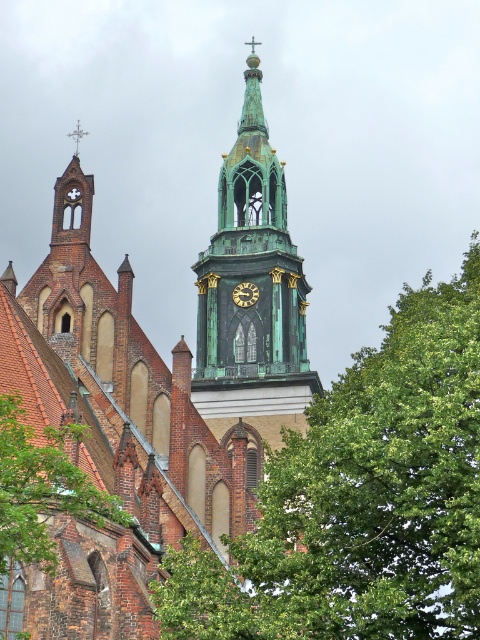
Question: Does green leafy tree at center appear on the right side of green leafy tree at lower left?

Choices:
 (A) yes
 (B) no

Answer: (A)

Question: Which point is closer to the camera?

Choices:
 (A) (54, 545)
 (B) (471, 436)

Answer: (B)

Question: Among these points, which one is farthest from the camera?

Choices:
 (A) click(236, 470)
 (B) click(405, 401)
 (C) click(110, 509)

Answer: (A)

Question: Which point is farther to the camera?

Choices:
 (A) green copper steeple at upper center
 (B) dark brown wooden clock at center
 (C) green leafy tree at lower left
 (D) green leafy tree at center

Answer: (B)

Question: Is green leafy tree at center positioned at the back of green leafy tree at lower left?

Choices:
 (A) no
 (B) yes

Answer: (B)

Question: In this image, where is green leafy tree at center located relative to green leafy tree at lower left?

Choices:
 (A) left
 (B) right

Answer: (B)